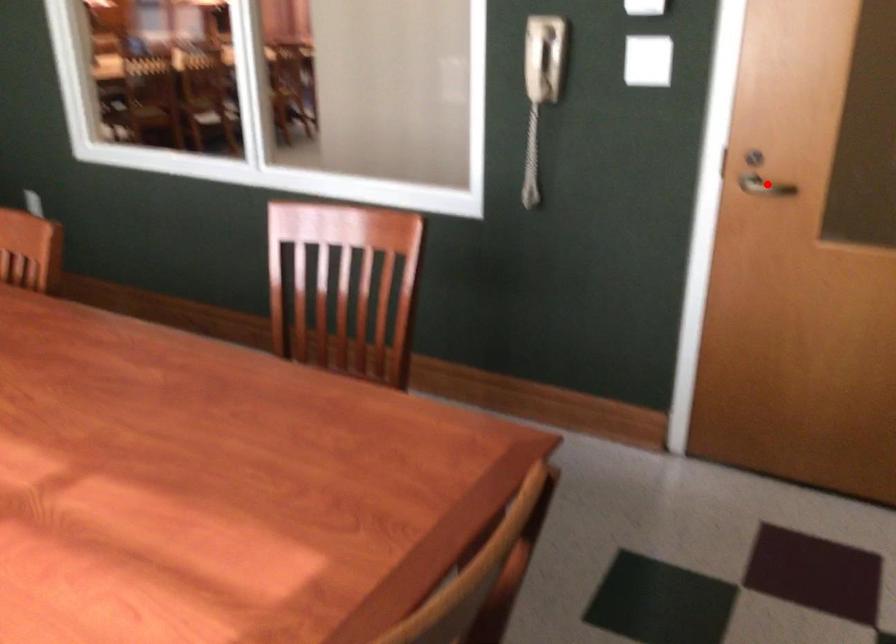
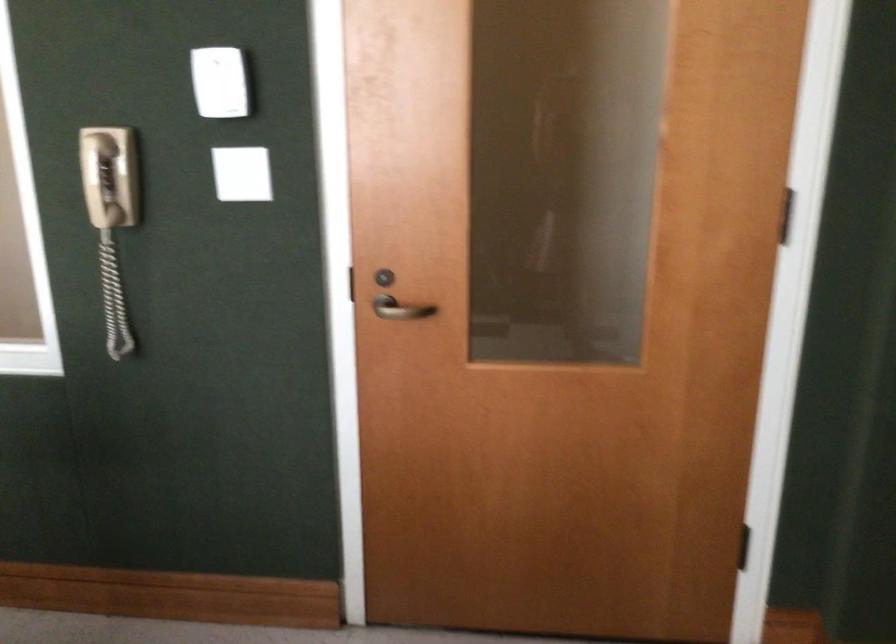
Question: I am providing you with two images of the same scene from different viewpoints. A red point is shown in image1. For the corresponding object point in image2, is it positioned nearer or farther from the camera?

Choices:
 (A) Nearer
 (B) Farther

Answer: (A)